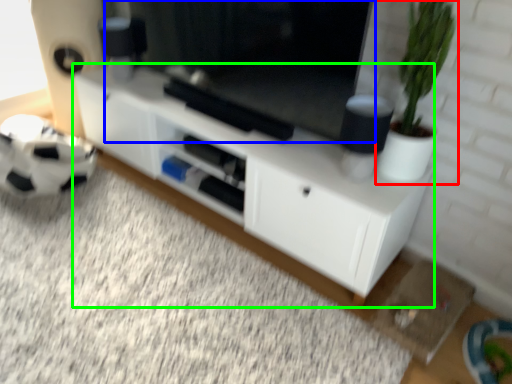
Question: Considering the real-world distances, which object is closest to houseplant (highlighted by a red box)? window screen (highlighted by a blue box) or cabinetry (highlighted by a green box).

Choices:
 (A) window screen
 (B) cabinetry

Answer: (A)